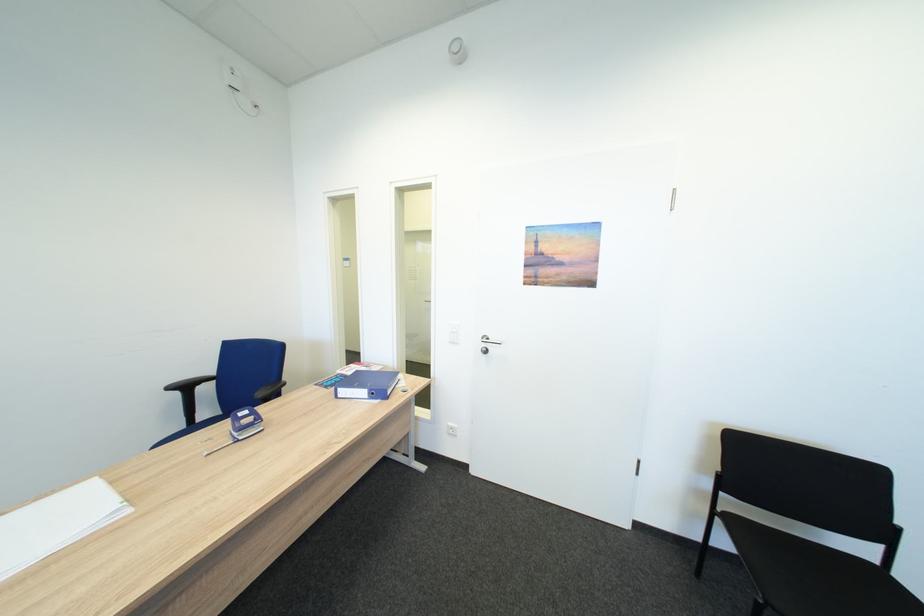
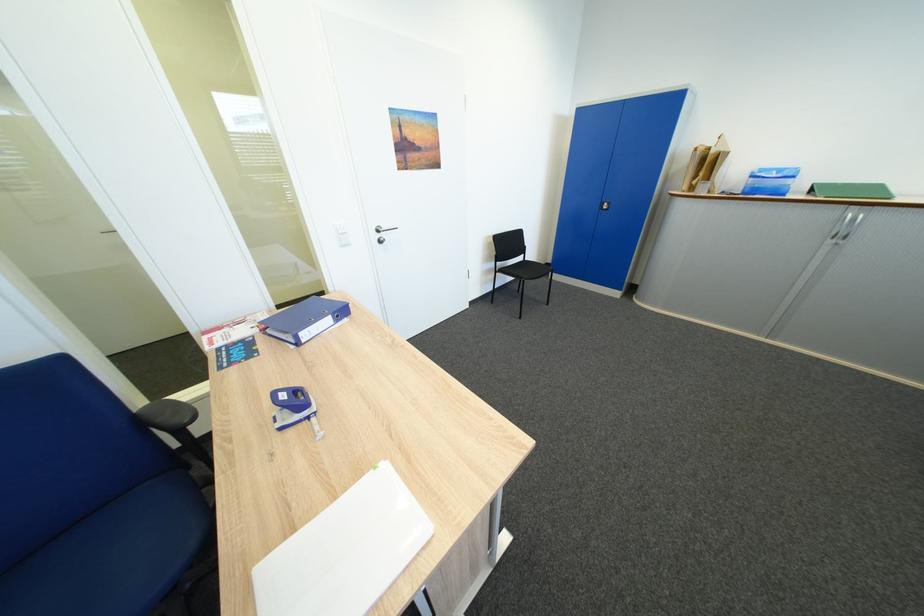
The point at (x=499, y=339) is marked in the first image. Where is the corresponding point in the second image?

(392, 229)